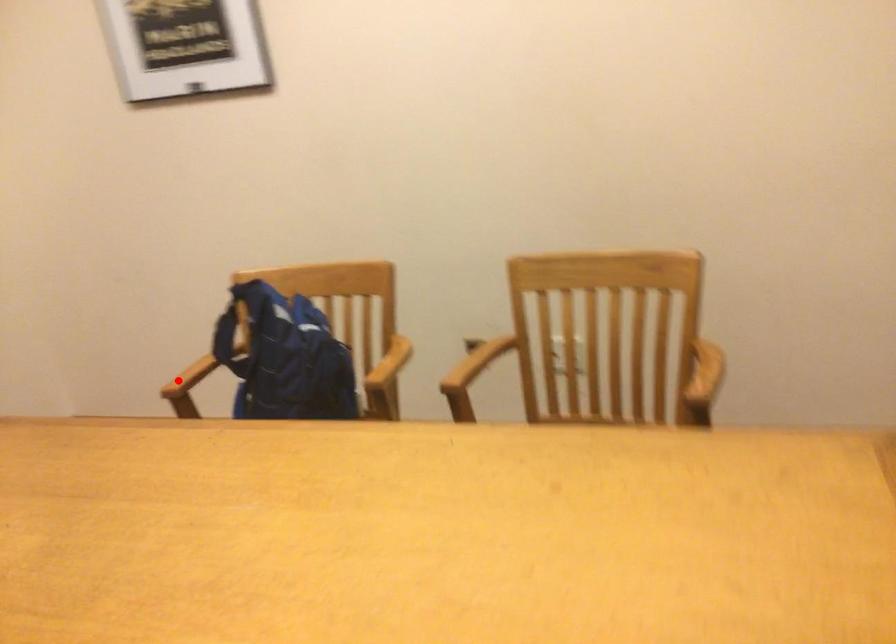
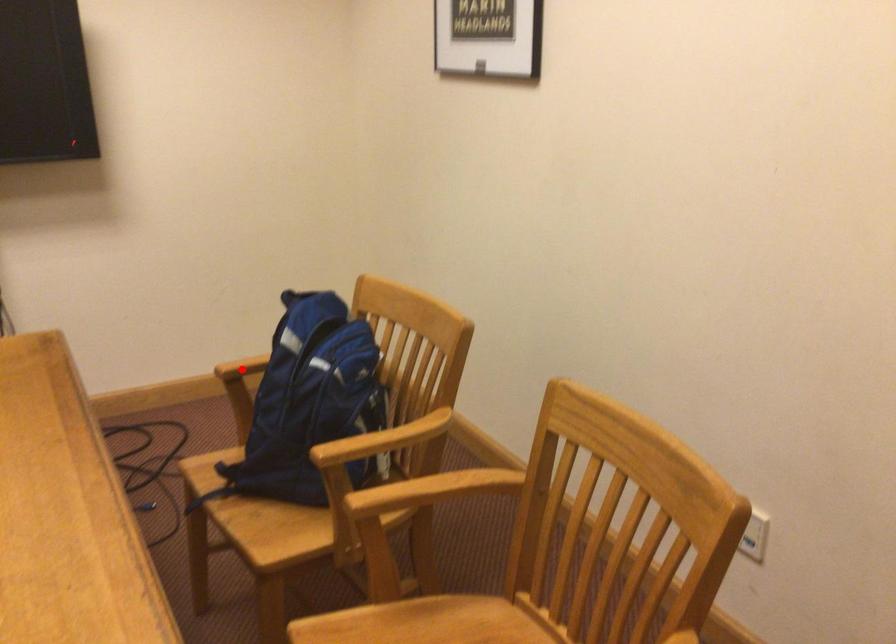
I am providing you with two images of the same scene from different viewpoints. A red point is marked on the first image and another point is marked on the second image. Does the point marked in image1 correspond to the same location as the one in image2?

Yes